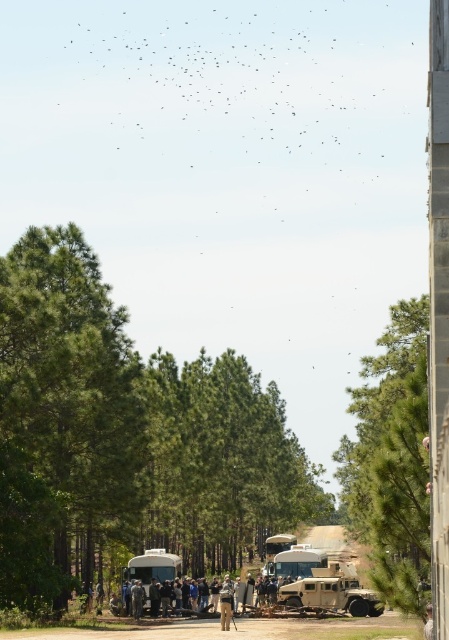
You are a photographer standing at the dirt road and want to take a photo of the green leafy tree at center and the camouflage uniform at center. Which object is located to the left of the other?

The green leafy tree at center is positioned on the left side of camouflage uniform at center, so the tree is to the left of the camouflage uniform.

Based on the coordinates provided, which object in the scene is located at point (124, 435)?

The point (124, 435) corresponds to the green leafy tree at center.